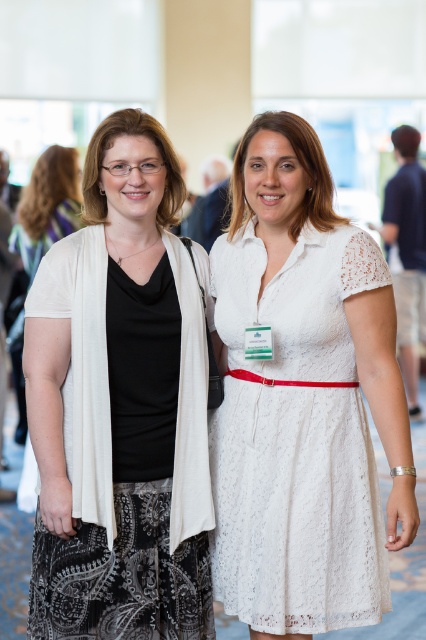
Does matte black top at left come behind white lace dress at center?

Yes, it is behind white lace dress at center.

Between matte black top at left and white lace dress at center, which one is positioned lower?

white lace dress at center is lower down.

Locate an element on the screen. The width and height of the screenshot is (426, 640). matte black top at left is located at coordinates pos(121,408).